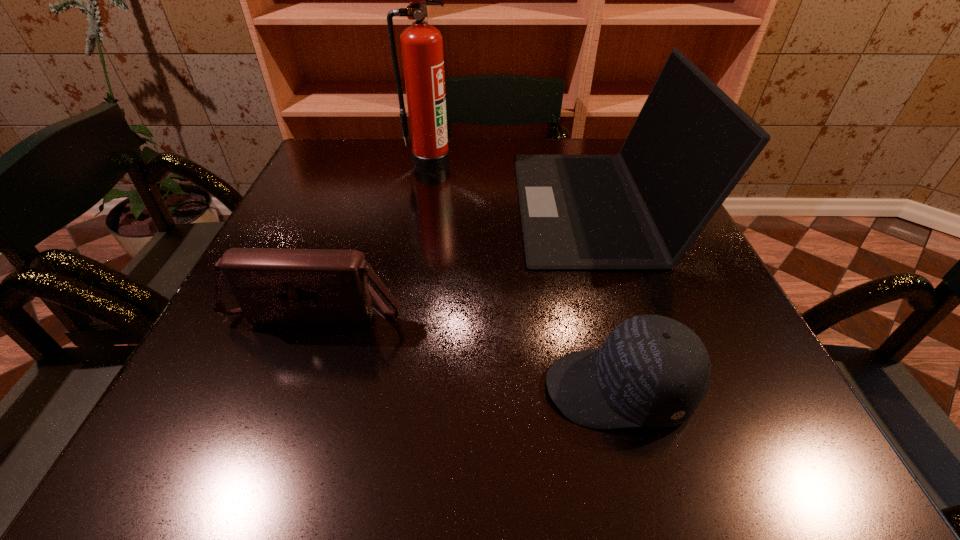
The height and width of the screenshot is (540, 960). I want to click on blank space located on the front flap of the second nearest object, so click(x=276, y=422).

Image resolution: width=960 pixels, height=540 pixels. Identify the location of vacant point located 0.290m at the front of the nearest object where the brim is located. (348, 388).

The height and width of the screenshot is (540, 960). In order to click on free region located at the front of the nearest object where the brim is located in this screenshot , I will do `click(328, 388)`.

You are a GUI agent. You are given a task and a screenshot of the screen. Output one action in this format:
    pyautogui.click(x=<x>, y=<y>)
    Task: Click on the vacant space located 0.260m at the front of the nearest object where the brim is located
    
    Given the screenshot: What is the action you would take?
    pyautogui.click(x=370, y=388)

You are a GUI agent. You are given a task and a screenshot of the screen. Output one action in this format:
    pyautogui.click(x=<x>, y=<y>)
    Task: Click on the fire extinguisher present at the far edge
    The height and width of the screenshot is (540, 960).
    Given the screenshot: What is the action you would take?
    pyautogui.click(x=421, y=43)

Identify the location of laptop situated at the far edge. This screenshot has height=540, width=960. 643,208.

Locate an element on the screen. The width and height of the screenshot is (960, 540). object at the near edge is located at coordinates (652, 371).

Identify the location of object that is at the left edge. Image resolution: width=960 pixels, height=540 pixels. (290, 287).

This screenshot has height=540, width=960. I want to click on laptop located in the right edge section of the desktop, so click(x=643, y=208).

Where is `baseball cap present at the right edge`? baseball cap present at the right edge is located at coordinates (652, 371).